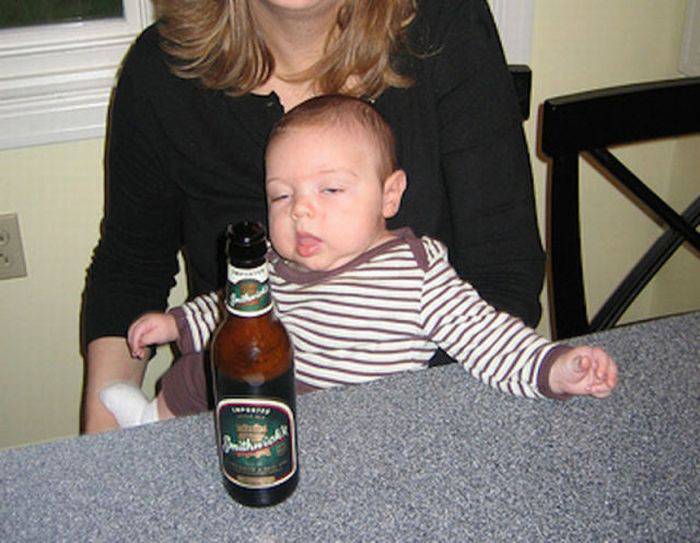
Where is `beer bottle`? This screenshot has height=543, width=700. beer bottle is located at coordinates (239, 333).